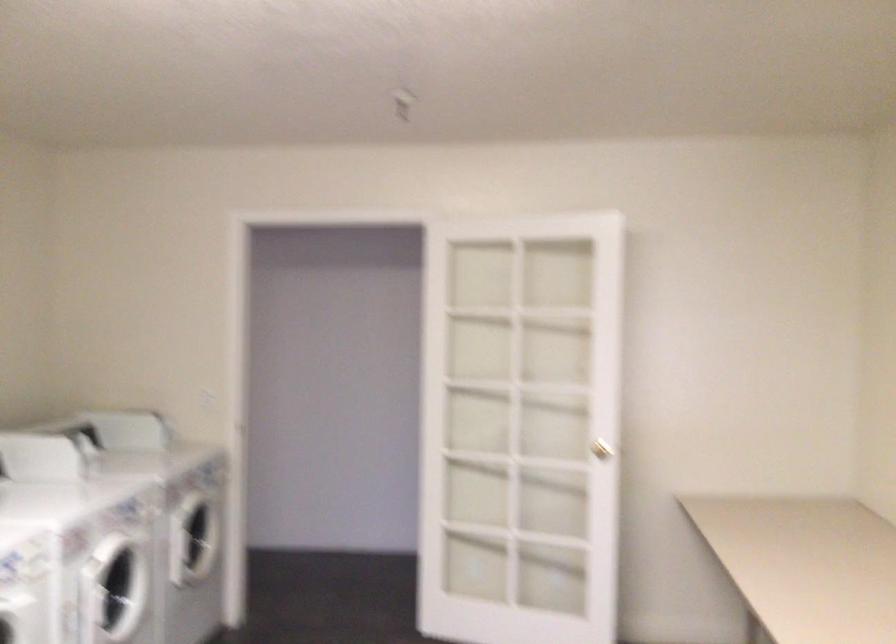
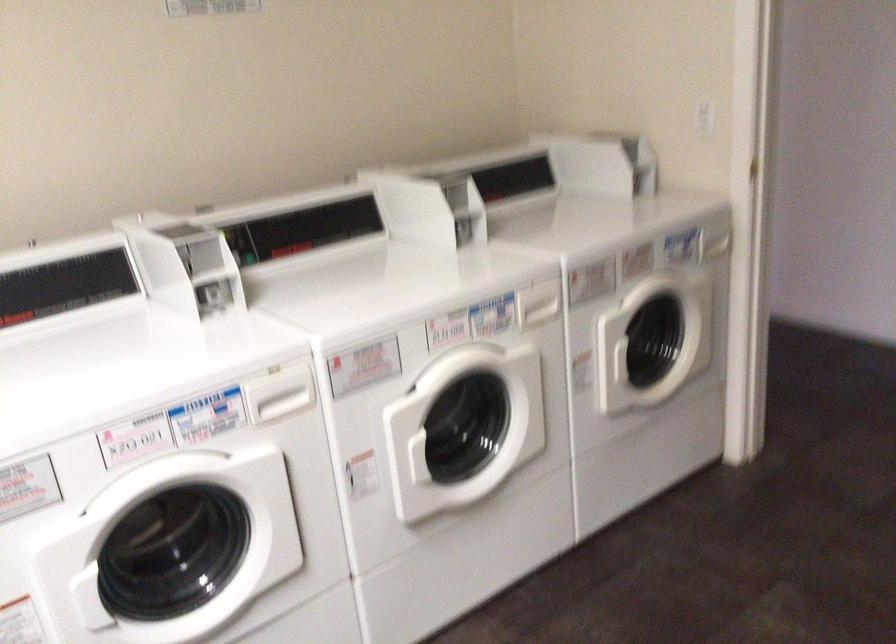
In the second image, find the point that corresponds to (131,518) in the first image.

(474, 322)